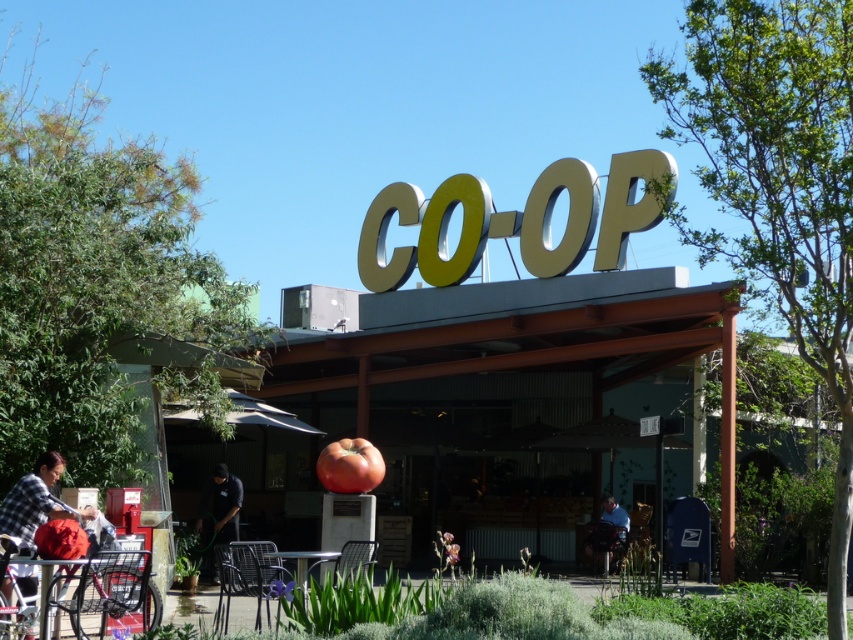
You are a delivery person trying to locate the entrance to the COOP building. You see the metallic gold sign at center and the plaid fabric shirt at lower left. Which object is closer to the entrance?

The metallic gold sign at center is taller than plaid fabric shirt at lower left, so the metallic gold sign at center is closer to the entrance since it is positioned higher up and likely above the entrance area.

You are a delivery person trying to locate the entrance of the COOP building. You see the metallic gold sign at center and the plaid fabric shirt at lower left. Which object is closer to the entrance?

The metallic gold sign at center is larger than the plaid fabric shirt at lower left, so it is likely closer to the entrance as larger objects are often placed at entrances for visibility.